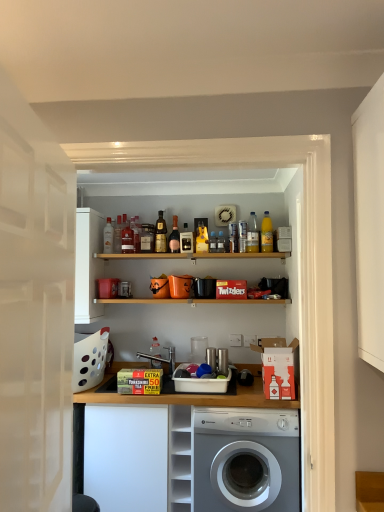
What is the approximate width of translucent plastic bottle at center, the 4th bottle from the right?

translucent plastic bottle at center, the 4th bottle from the right, is 2.02 inches in width.

What do you see at coordinates (174, 237) in the screenshot? Image resolution: width=384 pixels, height=512 pixels. I see `pink glass bottle at upper center, which is the 5th bottle from right to left` at bounding box center [174, 237].

Image resolution: width=384 pixels, height=512 pixels. I want to click on matte plastic bottle at upper center, which is the tenth bottle in right-to-left order, so click(x=117, y=234).

The width and height of the screenshot is (384, 512). What do you see at coordinates (252, 234) in the screenshot?
I see `translucent plastic bottle at upper center, placed as the tenth bottle when sorted from left to right` at bounding box center [252, 234].

Image resolution: width=384 pixels, height=512 pixels. Describe the element at coordinates (180, 458) in the screenshot. I see `white plastic cabinet at lower center` at that location.

The height and width of the screenshot is (512, 384). Identify the location of translucent plastic bottle at center, which ranks as the eighth bottle in left-to-right order. (213, 242).

Does point (232, 448) appear closer or farther from the camera than point (129, 234)?

Point (232, 448).

Between silver metallic washing machine at center and matte glass bottle at upper center, the ninth bottle from the right, which one appears on the left side from the viewer's perspective?

From the viewer's perspective, matte glass bottle at upper center, the ninth bottle from the right, appears more on the left side.

Is silver metallic washing machine at center positioned beyond the bounds of matte glass bottle at upper center, which ranks as the 3th bottle in left-to-right order?

silver metallic washing machine at center lies outside matte glass bottle at upper center, which ranks as the 3th bottle in left-to-right order,'s area.

From the image's perspective, which one is positioned lower, silver metallic washing machine at center or matte glass bottle at upper center, which ranks as the 3th bottle in left-to-right order?

silver metallic washing machine at center appears lower in the image.

The image size is (384, 512). Identify the location of washing machine that is in front of the yellow glass bottle at upper center, which ranks as the 11th bottle in left-to-right order. point(246,460).

From a real-world perspective, does silver metallic washing machine at center stand above yellow glass bottle at upper center, which ranks as the 11th bottle in left-to-right order?

No, from a real-world perspective, silver metallic washing machine at center is not over yellow glass bottle at upper center, which ranks as the 11th bottle in left-to-right order

Which object is more forward, silver metallic washing machine at center or yellow glass bottle at upper center, the 1th bottle in the right-to-left sequence?

silver metallic washing machine at center is closer to the camera.

Could you tell me if silver metallic washing machine at center is turned towards yellow glass bottle at upper center, the 1th bottle in the right-to-left sequence?

No, silver metallic washing machine at center is not facing towards yellow glass bottle at upper center, the 1th bottle in the right-to-left sequence.

From the picture: Is clear glass bottle at lower center, placed as the seventh bottle when sorted from right to left, bigger than matte glass bottle at upper center, positioned as the 1th bottle in left-to-right order?

Yes, clear glass bottle at lower center, placed as the seventh bottle when sorted from right to left, is bigger than matte glass bottle at upper center, positioned as the 1th bottle in left-to-right order.

Is clear glass bottle at lower center, placed as the seventh bottle when sorted from right to left, not within matte glass bottle at upper center, the 11th bottle from the right?

Indeed, clear glass bottle at lower center, placed as the seventh bottle when sorted from right to left, is completely outside matte glass bottle at upper center, the 11th bottle from the right.

Does point (157, 354) come behind point (111, 224)?

That is False.

Looking at the image, does matte glass bottle at upper center, the 11th bottle from the right, seem bigger or smaller compared to silver metallic washing machine at center?

Clearly, matte glass bottle at upper center, the 11th bottle from the right, is smaller in size than silver metallic washing machine at center.

Is matte glass bottle at upper center, positioned as the 1th bottle in left-to-right order, positioned with its back to silver metallic washing machine at center?

That's not correct — matte glass bottle at upper center, positioned as the 1th bottle in left-to-right order, is not looking away from silver metallic washing machine at center.

Between matte glass bottle at upper center, the 11th bottle from the right, and silver metallic washing machine at center, which one has smaller width?

With smaller width is matte glass bottle at upper center, the 11th bottle from the right.

Is the position of matte glass bottle at upper center, the 11th bottle from the right, less distant than that of silver metallic washing machine at center?

No, it is behind silver metallic washing machine at center.

Which of these two, shiny gold bottle at center, which is the 6th bottle in right-to-left order, or pink glass bottle at upper center, which is the 5th bottle from right to left, is wider?

With larger width is shiny gold bottle at center, which is the 6th bottle in right-to-left order.

Locate an element on the screen. the 1st bottle counting from the left of the pink glass bottle at upper center, which appears as the 7th bottle when viewed from the left is located at coordinates (160, 234).

Does shiny gold bottle at center, which is the sixth bottle from left to right, have a smaller size compared to pink glass bottle at upper center, which appears as the 7th bottle when viewed from the left?

No, shiny gold bottle at center, which is the sixth bottle from left to right, is not smaller than pink glass bottle at upper center, which appears as the 7th bottle when viewed from the left.

How many degrees apart are the facing directions of clear glass bottle at lower center, placed as the seventh bottle when sorted from right to left, and matte plastic bottle at center, acting as the third bottle starting from the right?

The facing directions of clear glass bottle at lower center, placed as the seventh bottle when sorted from right to left, and matte plastic bottle at center, acting as the third bottle starting from the right, are 1.86 degrees apart.

Is clear glass bottle at lower center, marked as the fifth bottle in a left-to-right arrangement, positioned beyond the bounds of matte plastic bottle at center, acting as the third bottle starting from the right?

clear glass bottle at lower center, marked as the fifth bottle in a left-to-right arrangement, lies outside matte plastic bottle at center, acting as the third bottle starting from the right,'s area.

From the image's perspective, would you say clear glass bottle at lower center, marked as the fifth bottle in a left-to-right arrangement, is shown under matte plastic bottle at center, acting as the third bottle starting from the right?

Indeed, from the image's perspective, clear glass bottle at lower center, marked as the fifth bottle in a left-to-right arrangement, is shown beneath matte plastic bottle at center, acting as the third bottle starting from the right.

Which is correct: matte plastic bottle at center, the 9th bottle viewed from the left, is inside white plastic cabinet at lower center, or outside of it?

matte plastic bottle at center, the 9th bottle viewed from the left, is not enclosed by white plastic cabinet at lower center.

Which object is positioned more to the right, matte plastic bottle at center, acting as the third bottle starting from the right, or white plastic cabinet at lower center?

matte plastic bottle at center, acting as the third bottle starting from the right.

Considering the relative sizes of matte plastic bottle at center, acting as the third bottle starting from the right, and white plastic cabinet at lower center in the image provided, is matte plastic bottle at center, acting as the third bottle starting from the right, wider than white plastic cabinet at lower center?

No.

Is matte plastic bottle at center, acting as the third bottle starting from the right, taller than white plastic cabinet at lower center?

No.

From the image's perspective, starting from the silver metallic washing machine at center, which bottle is the 5th one above? Please provide its 2D coordinates.

[(127, 238)]

You are a GUI agent. You are given a task and a screenshot of the screen. Output one action in this format:
    pyautogui.click(x=<x>, y=<y>)
    Task: Click on the washing machine lying in front of the yellow glass bottle at upper center, the 1th bottle in the right-to-left sequence
    This screenshot has width=384, height=512.
    Given the screenshot: What is the action you would take?
    pyautogui.click(x=246, y=460)

Based on their spatial positions, is translucent glass bottle at center, acting as the 4th bottle starting from the left, or matte black mug at center closer to matte glass bottle at upper center, positioned as the 1th bottle in left-to-right order?

translucent glass bottle at center, acting as the 4th bottle starting from the left, is closer to matte glass bottle at upper center, positioned as the 1th bottle in left-to-right order.

When comparing their distances from clear glass bottle at lower center, marked as the fifth bottle in a left-to-right arrangement, does silver metallic washing machine at center or translucent glass bottle at center, acting as the 4th bottle starting from the left, seem further?

The object further to clear glass bottle at lower center, marked as the fifth bottle in a left-to-right arrangement, is silver metallic washing machine at center.

Looking at this image, estimate the real-world distances between objects in this image. Which object is closer to matte plastic bottle at center, the 9th bottle viewed from the left, white plastic cabinet at lower center or white glossy door at left?

Among the two, white plastic cabinet at lower center is located nearer to matte plastic bottle at center, the 9th bottle viewed from the left.

Based on their spatial positions, is silver metallic washing machine at center or white plastic cabinet at lower center further from pink glass bottle at upper center, which is the 5th bottle from right to left?

silver metallic washing machine at center.

Estimate the real-world distances between objects in this image. Which object is further from matte plastic bottle at upper center, marked as the 2th bottle in a left-to-right arrangement, matte glass bottle at upper center, the 11th bottle from the right, or matte black mug at center?

matte black mug at center.

When comparing their distances from yellow glass bottle at upper center, which ranks as the 11th bottle in left-to-right order, does shiny gold bottle at center, which is the sixth bottle from left to right, or white plastic cabinet at lower center seem closer?

Among the two, shiny gold bottle at center, which is the sixth bottle from left to right, is located nearer to yellow glass bottle at upper center, which ranks as the 11th bottle in left-to-right order.

Which object lies further to the anchor point translucent plastic bottle at center, the 4th bottle from the right, translucent glass bottle at center, positioned as the 8th bottle in right-to-left order, or clear glass bottle at lower center, placed as the seventh bottle when sorted from right to left?

clear glass bottle at lower center, placed as the seventh bottle when sorted from right to left.

Based on their spatial positions, is white plastic cabinet at lower center or white matte cabinet at lower left closer to yellow glass bottle at upper center, which ranks as the 11th bottle in left-to-right order?

Based on the image, white plastic cabinet at lower center appears to be nearer to yellow glass bottle at upper center, which ranks as the 11th bottle in left-to-right order.

At what (x,y) coordinates should I click in order to perform the action: click on appliance between pink glass bottle at upper center, which is the 5th bottle from right to left, and white plastic cabinet at lower center, in the vertical direction. Please return your answer as a coordinate pair (x, y). Looking at the image, I should click on (205, 288).

The height and width of the screenshot is (512, 384). Find the location of `cabinetry between white glossy door at left and pink glass bottle at upper center, which appears as the 7th bottle when viewed from the left, along the z-axis`. cabinetry between white glossy door at left and pink glass bottle at upper center, which appears as the 7th bottle when viewed from the left, along the z-axis is located at coordinates (126, 457).

Locate an element on the screen. appliance between white glossy door at left and translucent glass bottle at center, positioned as the 8th bottle in right-to-left order, in the front-back direction is located at coordinates (205, 288).

Identify the location of appliance between matte plastic bottle at upper center, which is the tenth bottle in right-to-left order, and clear glass bottle at lower center, placed as the seventh bottle when sorted from right to left, vertically. (205, 288).